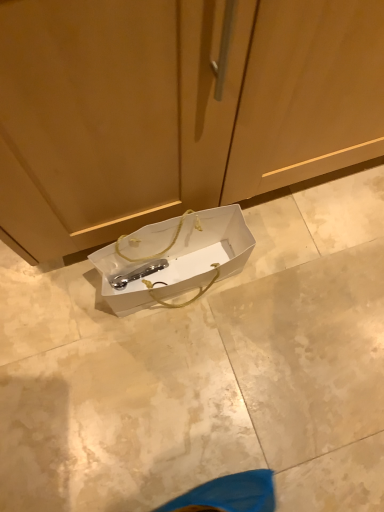
Question: Choose the correct answer: Is matte wood cabinet at center inside white paper bag at center or outside it?

Choices:
 (A) outside
 (B) inside

Answer: (A)

Question: Is matte wood cabinet at center taller or shorter than white paper bag at center?

Choices:
 (A) short
 (B) tall

Answer: (B)

Question: Considering the relative positions of matte wood cabinet at center and white paper bag at center in the image provided, is matte wood cabinet at center to the left or to the right of white paper bag at center?

Choices:
 (A) left
 (B) right

Answer: (B)

Question: Visually, is white paper bag at center positioned to the left or to the right of matte wood cabinet at center?

Choices:
 (A) right
 (B) left

Answer: (B)

Question: Is point (170, 280) positioned closer to the camera than point (329, 134)?

Choices:
 (A) farther
 (B) closer

Answer: (A)

Question: Is white paper bag at center inside the boundaries of matte wood cabinet at center, or outside?

Choices:
 (A) inside
 (B) outside

Answer: (B)

Question: From a real-world perspective, is white paper bag at center physically located above or below matte wood cabinet at center?

Choices:
 (A) above
 (B) below

Answer: (B)